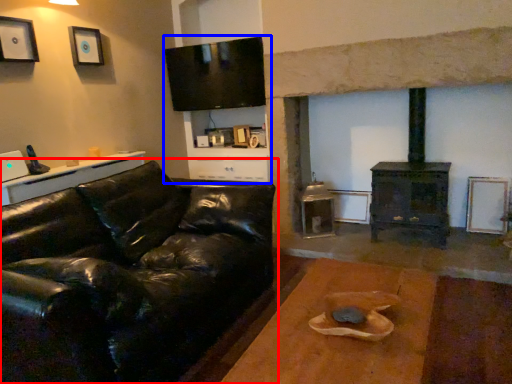
Question: Which of the following is the closest to the observer, studio couch (highlighted by a red box) or entertainment center (highlighted by a blue box)?

Choices:
 (A) studio couch
 (B) entertainment center

Answer: (A)